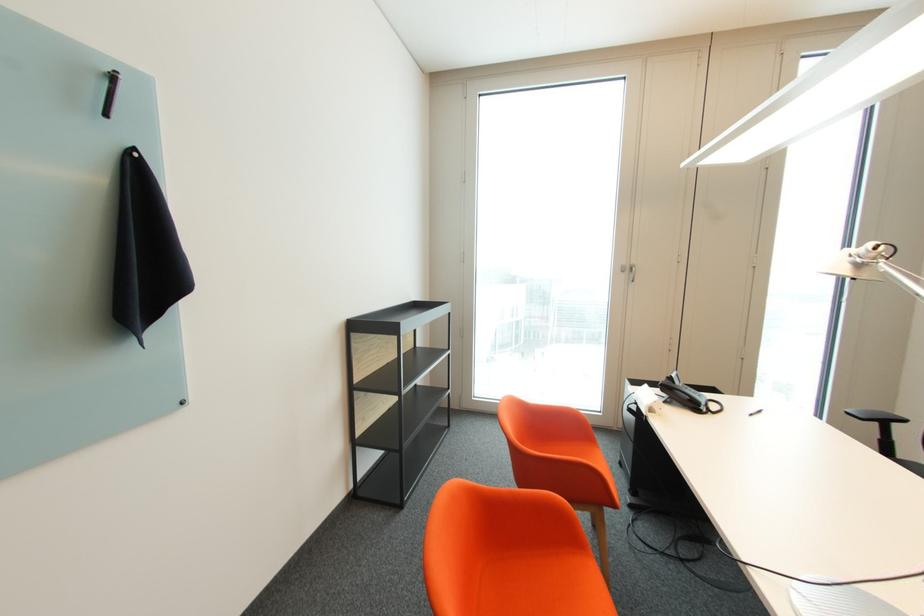
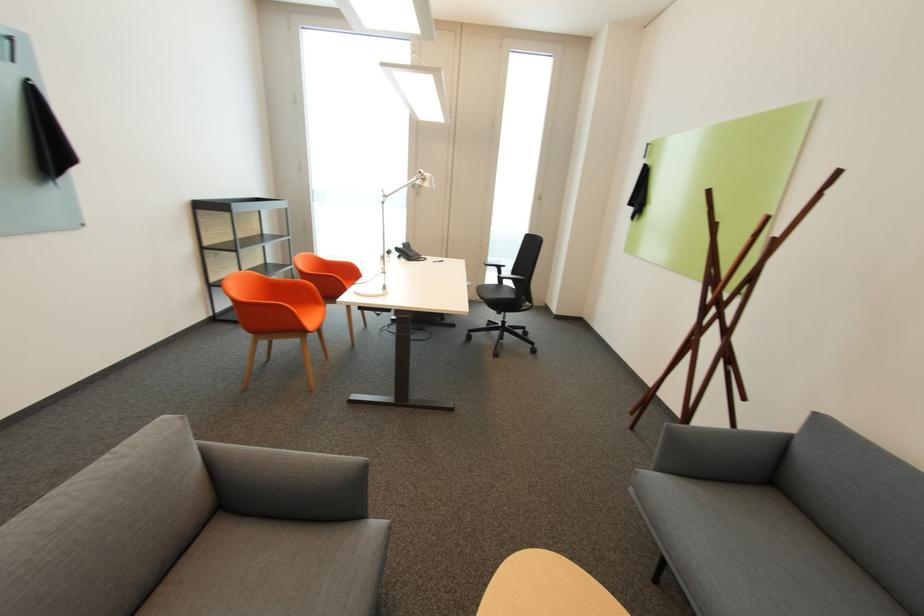
In the second image, find the point that corresponds to the point at 710,408 in the first image.

(419, 259)